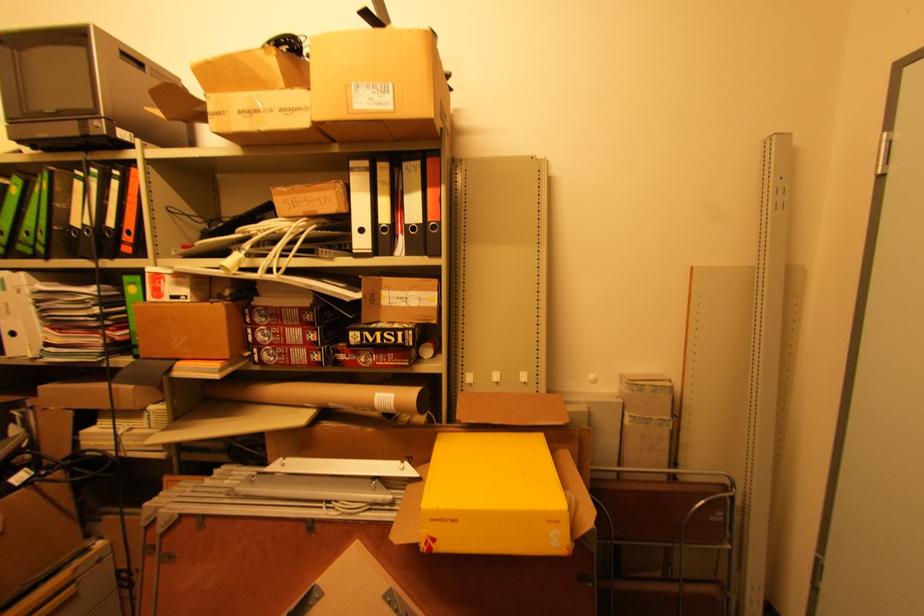
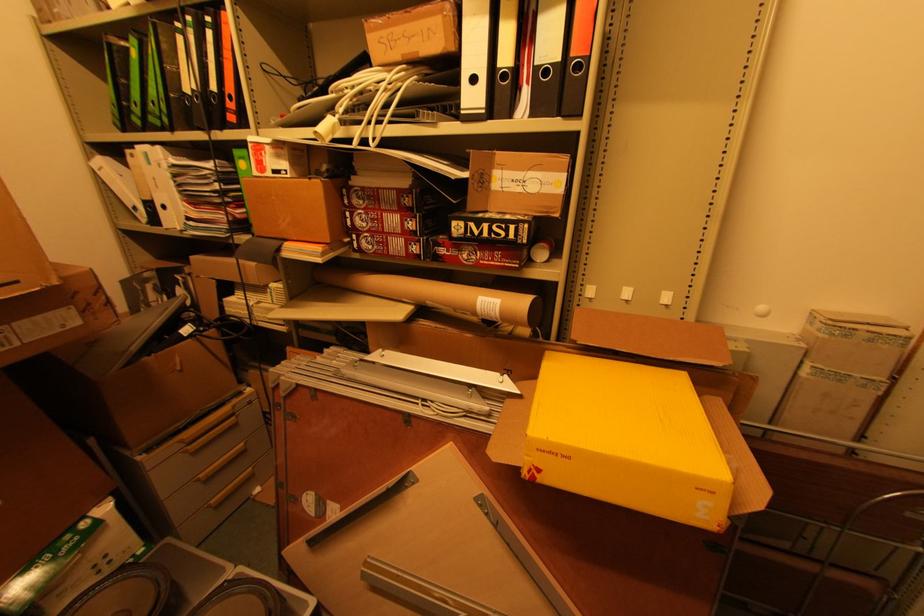
What movement of the cameraman would produce the second image?

The cameraman walked toward left, forward.